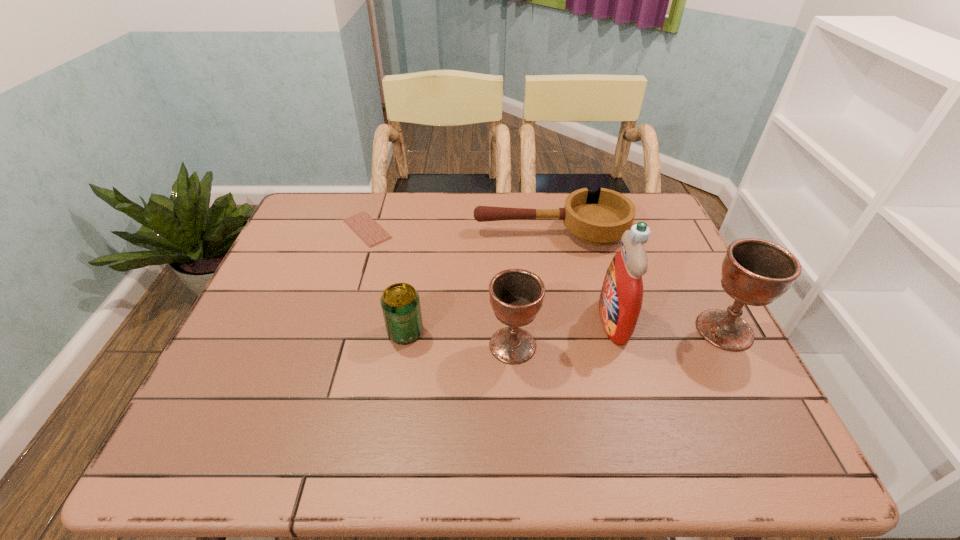
The width and height of the screenshot is (960, 540). I want to click on saucepan positioned at the far edge, so click(x=599, y=218).

The height and width of the screenshot is (540, 960). What are the coordinates of `chocolate bar that is at the far edge` in the screenshot? It's located at (362, 224).

Identify the location of object present at the left edge. (362, 224).

This screenshot has width=960, height=540. Identify the location of chalice present at the right edge. (755, 272).

Where is `saucepan situated at the right edge`? saucepan situated at the right edge is located at coordinates (599, 218).

Locate an element on the screen. This screenshot has width=960, height=540. object located at the far left corner is located at coordinates (362, 224).

Find the location of a particular element. This screenshot has width=960, height=540. object present at the far right corner is located at coordinates (599, 218).

At what (x,y) coordinates should I click in order to perform the action: click on free space at the far edge of the desktop. Please return your answer as a coordinate pair (x, y). Looking at the image, I should click on (508, 198).

You are a GUI agent. You are given a task and a screenshot of the screen. Output one action in this format:
    pyautogui.click(x=<x>, y=<y>)
    Task: Click on the vacant space at the near edge of the desktop
    
    Given the screenshot: What is the action you would take?
    pyautogui.click(x=370, y=413)

Where is `vacant area at the right edge of the desktop`? The height and width of the screenshot is (540, 960). vacant area at the right edge of the desktop is located at coordinates pos(650,290).